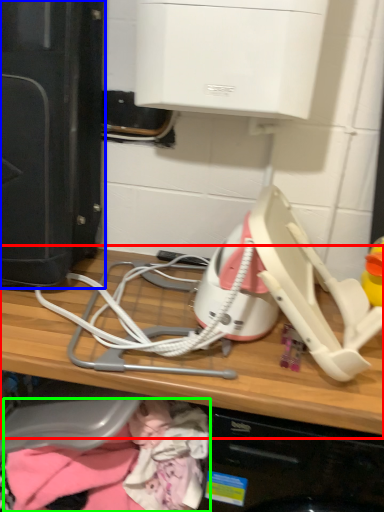
Question: Considering the real-world distances, which object is closest to computer (highlighted by a red box)? home appliance (highlighted by a blue box) or clothing (highlighted by a green box).

Choices:
 (A) home appliance
 (B) clothing

Answer: (B)